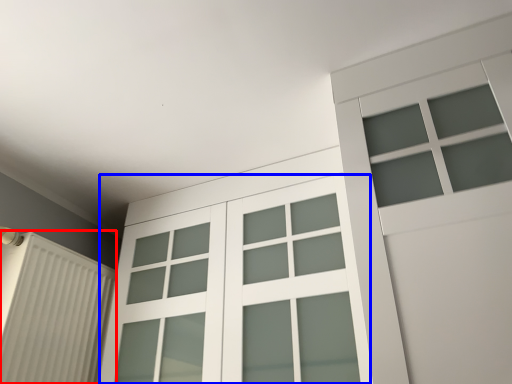
Question: Which object is further to the camera taking this photo, shutter (highlighted by a red box) or glass door (highlighted by a blue box)?

Choices:
 (A) shutter
 (B) glass door

Answer: (A)